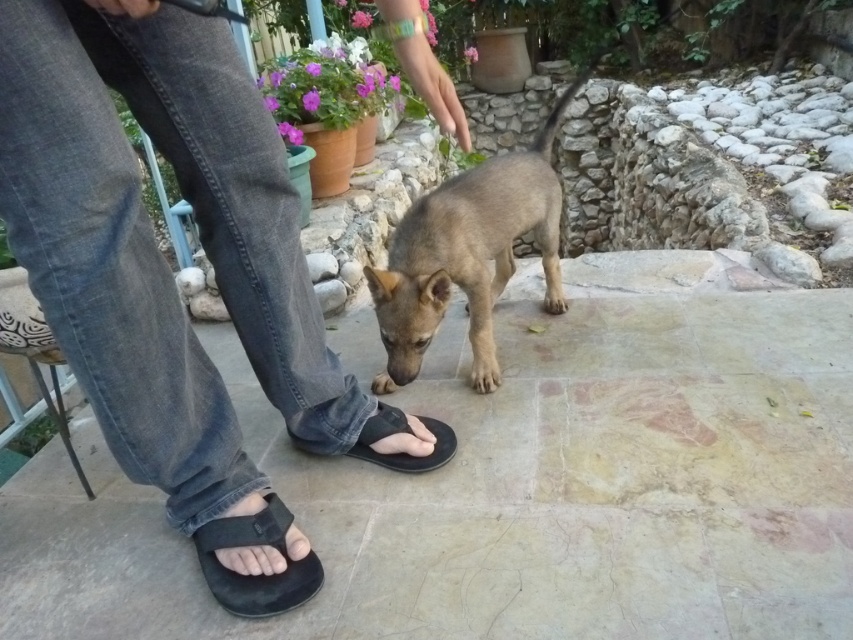
From the picture: You are a photographer trying to capture a closeup of the denim jeans at lower left and the black fabric sandal at lower left. Since you want to focus on the details of both items, which one should you zoom in on first to ensure it fills the frame appropriately?

The denim jeans at lower left has a larger size compared to the black fabric sandal at lower left, so you should zoom in on the denim jeans at lower left first to ensure it fills the frame appropriately.

You are a photographer trying to capture the perfect shot of the denim jeans at lower left and the black fabric sandal at lower left. Since you want to focus on the jeans, which object should you position closer to the camera lens?

The denim jeans at lower left is closer to the viewer than the black fabric sandal at lower left, so you should position the denim jeans at lower left closer to the camera lens to focus on it.